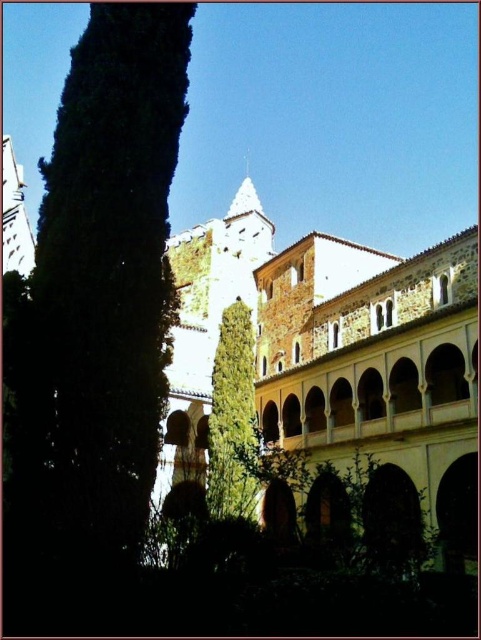
Based on the photo, you are standing in the courtyard and want to take a photo that includes both the green leafy tree at left and the green leafy tree at center. Which tree should you position closer to the camera to ensure both are fully visible in the frame?

You should position the green leafy tree at left closer to the camera because it is wider than the green leafy tree at center, so it requires more space in the frame to be fully visible.

Looking at this image, you are standing in the courtyard and want to walk to the historic building. You notice two points marked in the scene. Which point, point (50, 234) or point (247, 326), is closer to you as you face the building?

Point (50, 234) is closer to the viewer than point (247, 326), so it is the closer point.